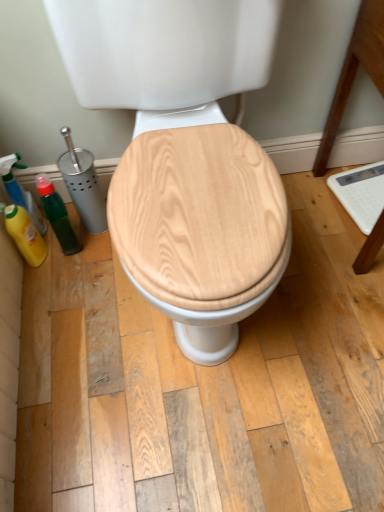
Image resolution: width=384 pixels, height=512 pixels. Find the location of `vacant area that lies between wooden toilet seat at center and matte green spray bottle at left, the first cleaning product when ordered from top to bottom`. vacant area that lies between wooden toilet seat at center and matte green spray bottle at left, the first cleaning product when ordered from top to bottom is located at coordinates click(x=92, y=290).